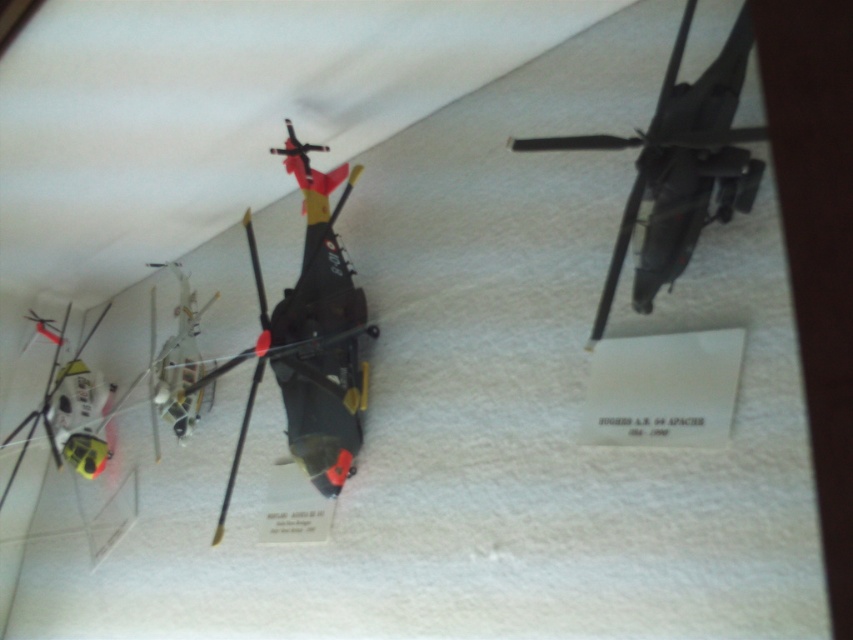
Question: From the image, what is the correct spatial relationship of matte black helicopter at upper right in relation to metallic silver helicopter at center?

Choices:
 (A) left
 (B) right

Answer: (B)

Question: Which of the following is the closest to the observer?

Choices:
 (A) matte black helicopter at upper right
 (B) metallic silver helicopter at center

Answer: (A)

Question: Which point is closer to the camera?

Choices:
 (A) matte black helicopter at upper right
 (B) metallic silver helicopter at center

Answer: (A)

Question: Does matte black helicopter at upper right lie in front of metallic silver helicopter at center?

Choices:
 (A) yes
 (B) no

Answer: (A)

Question: Can you confirm if matte black helicopter at upper right is positioned to the right of metallic silver helicopter at center?

Choices:
 (A) no
 (B) yes

Answer: (B)